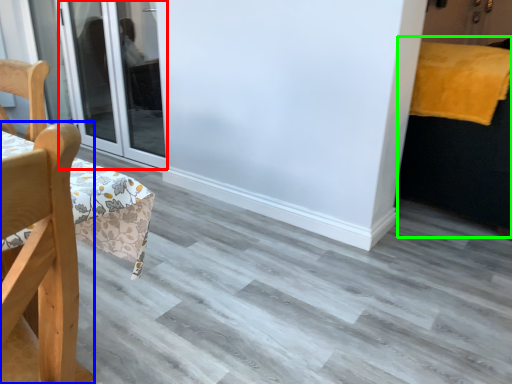
Question: Considering the real-world distances, which object is closest to door (highlighted by a red box)? chair (highlighted by a blue box) or bed (highlighted by a green box).

Choices:
 (A) chair
 (B) bed

Answer: (B)